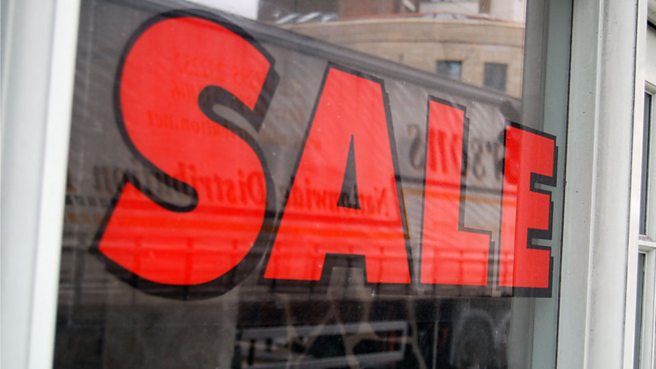
Find the location of a particular element. The image size is (656, 369). window is located at coordinates (497, 77).